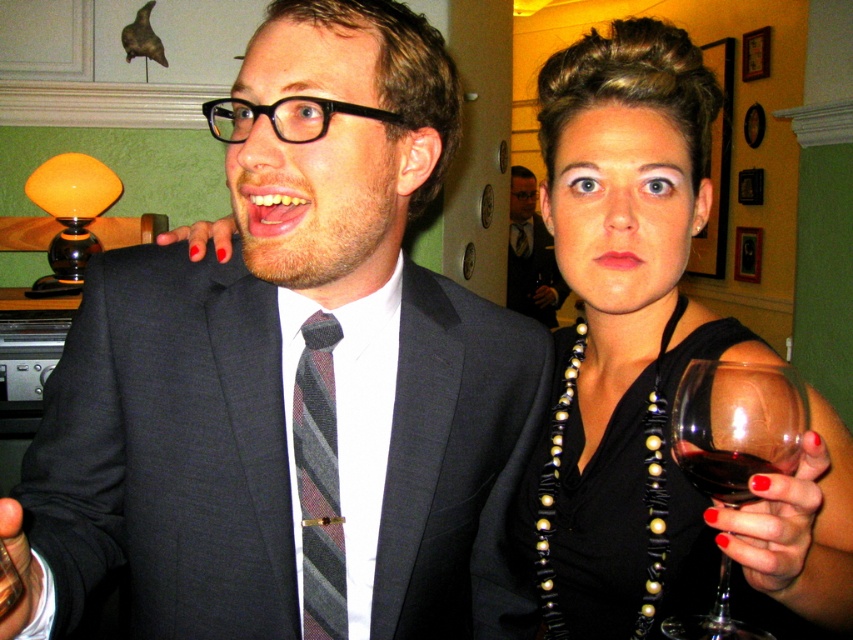
Question: Is matte black suit at center smaller than transparent glass at right?

Choices:
 (A) no
 (B) yes

Answer: (A)

Question: Based on their relative distances, which object is farther from the dark gray striped tie at center?

Choices:
 (A) black satin dress at center
 (B) striped fabric tie at center
 (C) dark red liquid at right

Answer: (C)

Question: Which point is closer to the camera?

Choices:
 (A) (323, 500)
 (B) (694, 460)

Answer: (B)

Question: Does black pearl necklace at upper center have a lesser width compared to striped fabric tie at center?

Choices:
 (A) yes
 (B) no

Answer: (B)

Question: Which point is closer to the camera?

Choices:
 (A) (746, 486)
 (B) (99, 339)

Answer: (A)

Question: Does black satin dress at center lie in front of dark red liquid at right?

Choices:
 (A) yes
 (B) no

Answer: (B)